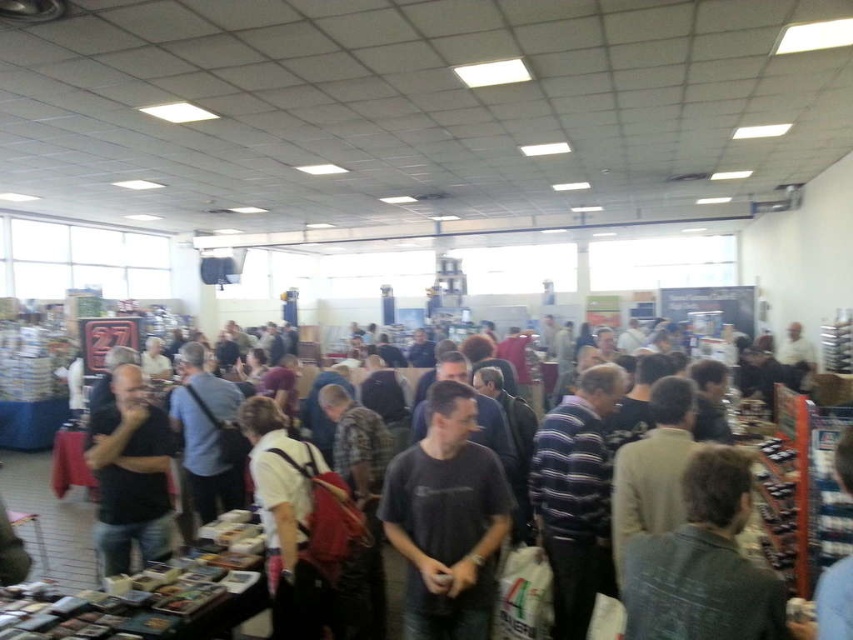
Question: Which object appears closest to the camera in this image?

Choices:
 (A) black matte shirt at left
 (B) dark gray t-shirt at center

Answer: (B)

Question: Is dark gray t-shirt at center positioned at the back of black matte shirt at left?

Choices:
 (A) yes
 (B) no

Answer: (B)

Question: Among these points, which one is farthest from the camera?

Choices:
 (A) (119, 401)
 (B) (480, 508)

Answer: (A)

Question: Can you confirm if dark gray t-shirt at center is smaller than black matte shirt at left?

Choices:
 (A) yes
 (B) no

Answer: (A)

Question: From the image, what is the correct spatial relationship of dark gray t-shirt at center in relation to black matte shirt at left?

Choices:
 (A) right
 (B) left

Answer: (A)